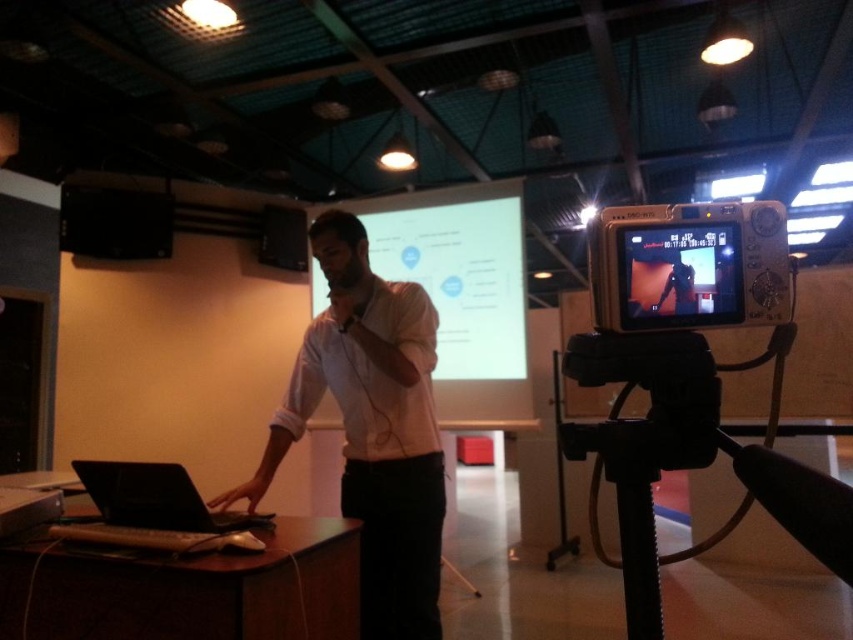
You are setting up equipment in the presentation room. You have a black plastic tripod at lower right and a silver plastic video camera at center. Which object is taller?

The black plastic tripod at lower right is taller than the silver plastic video camera at center.

You are an attendee in the presentation and want to take a photo of the matte black screen at upper right. Where should you position yourself relative to the speaker to ensure the screen is fully visible in your camera frame?

The matte black screen at upper right is positioned at coordinates point (679, 275), so you should position yourself to the right side of the speaker to capture the screen in your camera frame.

You are setting up equipment for a live stream in the presentation room. You have a black plastic tripod at lower right and a silver plastic video camera at center. Where should you place the camera relative to the tripod to align with the current setup?

The black plastic tripod at lower right is to the left of silver plastic video camera at center, so you should place the silver plastic video camera at center to the right of the black plastic tripod at lower right to maintain alignment with the current setup.